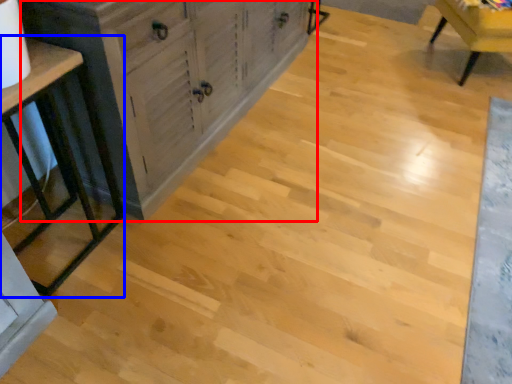
Question: Which point is further to the camera, cabinetry (highlighted by a red box) or table (highlighted by a blue box)?

Choices:
 (A) cabinetry
 (B) table

Answer: (A)